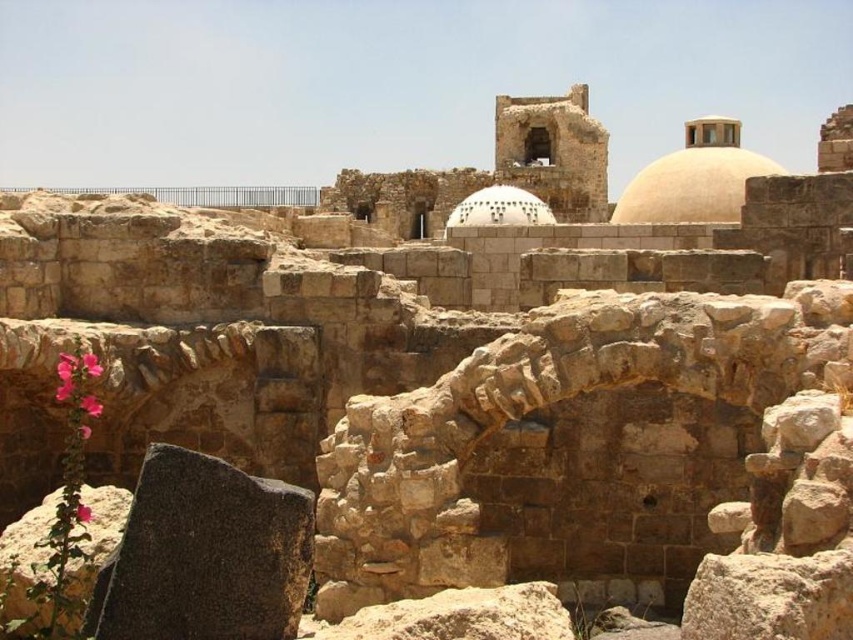
Who is more distant from viewer, (706, 188) or (531, 204)?

Point (531, 204)

Locate an element on the screen. beige stone dome at upper center is located at coordinates (694, 179).